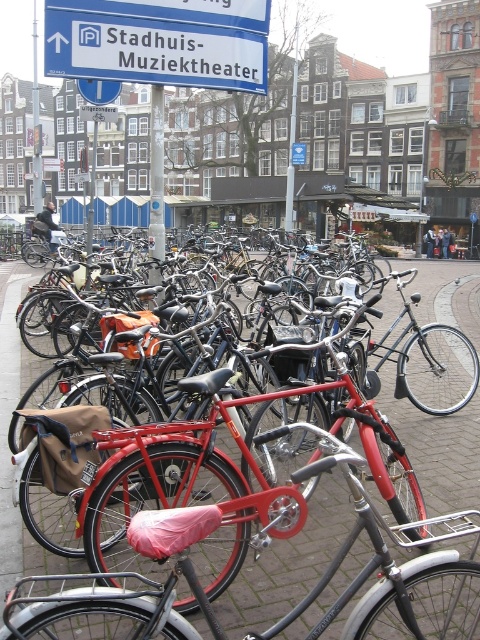
Based on the photo, you are standing at the entrance of the bicycle parking area and want to walk to the brick pavement at center. Which direction should you move in to reach it?

The brick pavement at center is located at point 0.716 on the x axis and 0.017 on the y axis, so you should move towards the right and slightly forward to reach it.

You are standing at the entrance of the bicycle parking area and want to locate the metallic pole at center. According to the coordinates provided, where should you look?

The metallic pole at center is located at coordinates point [156,173].

You are standing at the starting point and want to reach the destination point in the bicycle parking area. The starting point is at point (37, 83) and the destination is at point (156, 109). According to the scene, which direction should you move to reach the destination from the starting point?

Point (156, 109) is in front of point (37, 83), so you should move forward to reach the destination from the starting point.